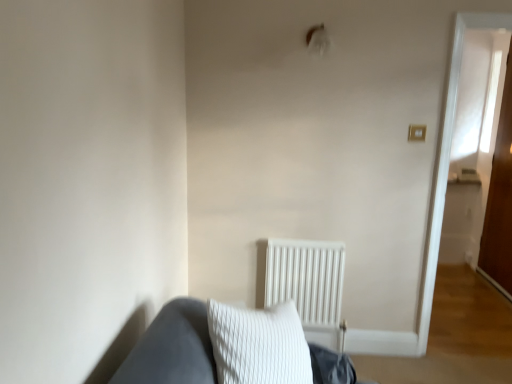
Question: Is white matte radiator at center located within transparent glass door at right?

Choices:
 (A) no
 (B) yes

Answer: (A)

Question: Can you confirm if transparent glass door at right is thinner than white matte radiator at center?

Choices:
 (A) no
 (B) yes

Answer: (B)

Question: From a real-world perspective, is transparent glass door at right over white matte radiator at center?

Choices:
 (A) no
 (B) yes

Answer: (B)

Question: Is transparent glass door at right beside white matte radiator at center?

Choices:
 (A) yes
 (B) no

Answer: (B)

Question: From the image's perspective, would you say transparent glass door at right is shown under white matte radiator at center?

Choices:
 (A) no
 (B) yes

Answer: (A)

Question: Does transparent glass door at right have a smaller size compared to white matte radiator at center?

Choices:
 (A) yes
 (B) no

Answer: (B)

Question: Considering the relative sizes of white matte radiator at center and transparent glass door at right in the image provided, is white matte radiator at center taller than transparent glass door at right?

Choices:
 (A) no
 (B) yes

Answer: (A)

Question: Does white matte radiator at center turn towards transparent glass door at right?

Choices:
 (A) yes
 (B) no

Answer: (B)

Question: Is white matte radiator at center facing away from transparent glass door at right?

Choices:
 (A) yes
 (B) no

Answer: (B)

Question: Does white matte radiator at center appear on the left side of transparent glass door at right?

Choices:
 (A) yes
 (B) no

Answer: (A)

Question: From the image's perspective, is white matte radiator at center on transparent glass door at right?

Choices:
 (A) no
 (B) yes

Answer: (A)

Question: Is the position of white matte radiator at center less distant than that of transparent glass door at right?

Choices:
 (A) yes
 (B) no

Answer: (A)

Question: From the image's perspective, is transparent glass door at right above or below white matte radiator at center?

Choices:
 (A) above
 (B) below

Answer: (A)